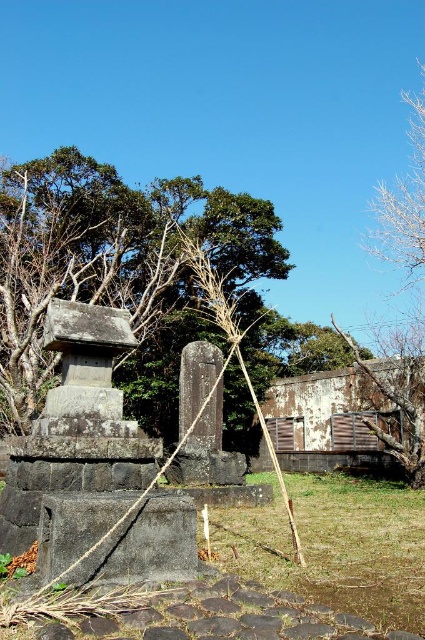
How distant is green leafy tree at upper center from green grass at lower center?

green leafy tree at upper center and green grass at lower center are 13.25 meters apart.

Does green leafy tree at upper center have a smaller size compared to green grass at lower center?

No.

Where is `green leafy tree at upper center`? The height and width of the screenshot is (640, 425). green leafy tree at upper center is located at coordinates (108, 257).

Can you confirm if green leafy tree at upper center is positioned to the left of bare wood tree at right?

Correct, you'll find green leafy tree at upper center to the left of bare wood tree at right.

What do you see at coordinates (108, 257) in the screenshot? I see `green leafy tree at upper center` at bounding box center [108, 257].

Find the location of a particular element. green leafy tree at upper center is located at coordinates (108, 257).

Does green grass at lower center have a greater height compared to bare wood tree at right?

Incorrect, green grass at lower center's height is not larger of bare wood tree at right's.

Does point (376, 529) come farther from viewer compared to point (399, 381)?

No, it is in front of (399, 381).

What are the coordinates of `green grass at lower center` in the screenshot? It's located at pos(334,545).